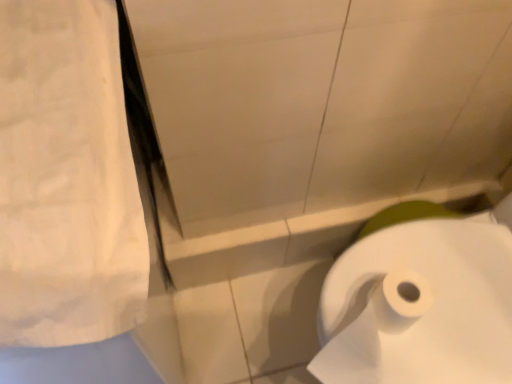
Question: Based on their positions, is white cotton towel at upper left located to the left or right of white paper at lower right?

Choices:
 (A) right
 (B) left

Answer: (B)

Question: From a real-world perspective, relative to white paper at lower right, is white cotton towel at upper left vertically above or below?

Choices:
 (A) above
 (B) below

Answer: (A)

Question: Considering the positions of point (94, 119) and point (504, 340), is point (94, 119) closer or farther from the camera than point (504, 340)?

Choices:
 (A) farther
 (B) closer

Answer: (B)

Question: In terms of size, does white paper at lower right appear bigger or smaller than white cotton towel at upper left?

Choices:
 (A) small
 (B) big

Answer: (A)

Question: Is white paper at lower right to the left or to the right of white cotton towel at upper left in the image?

Choices:
 (A) left
 (B) right

Answer: (B)

Question: Is point (399, 301) positioned closer to the camera than point (75, 296)?

Choices:
 (A) closer
 (B) farther

Answer: (B)

Question: From the image's perspective, is white paper at lower right above or below white cotton towel at upper left?

Choices:
 (A) above
 (B) below

Answer: (B)